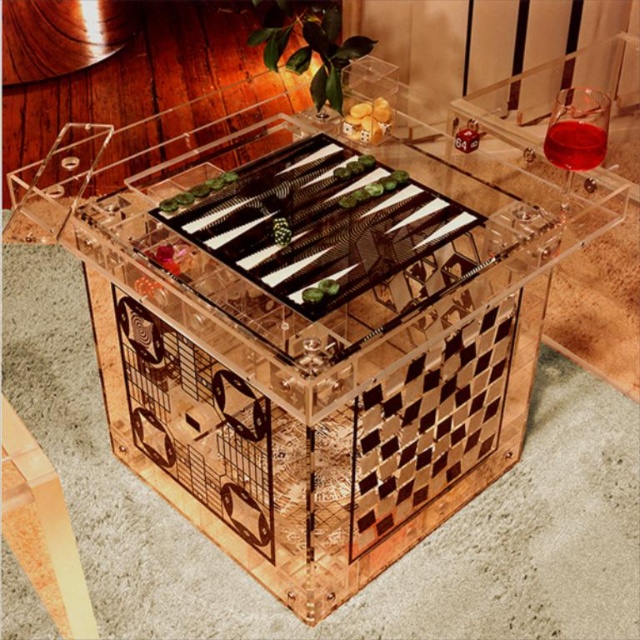
Question: Is transparent glass wine at upper right above transparent liquid at upper right?

Choices:
 (A) no
 (B) yes

Answer: (A)

Question: Which is nearer to the translucent plastic dice at center?

Choices:
 (A) transparent liquid at upper right
 (B) transparent glass wine at upper right

Answer: (B)

Question: In this image, where is transparent glass wine at upper right located relative to translucent plastic dice at center?

Choices:
 (A) right
 (B) left

Answer: (A)

Question: Which of the following is the closest to the observer?

Choices:
 (A) (369, 131)
 (B) (552, 134)
 (C) (577, 163)

Answer: (C)

Question: Based on their relative distances, which object is nearer to the transparent liquid at upper right?

Choices:
 (A) transparent glass wine at upper right
 (B) translucent plastic dice at center

Answer: (A)

Question: Is transparent glass wine at upper right bigger than transparent liquid at upper right?

Choices:
 (A) no
 (B) yes

Answer: (B)